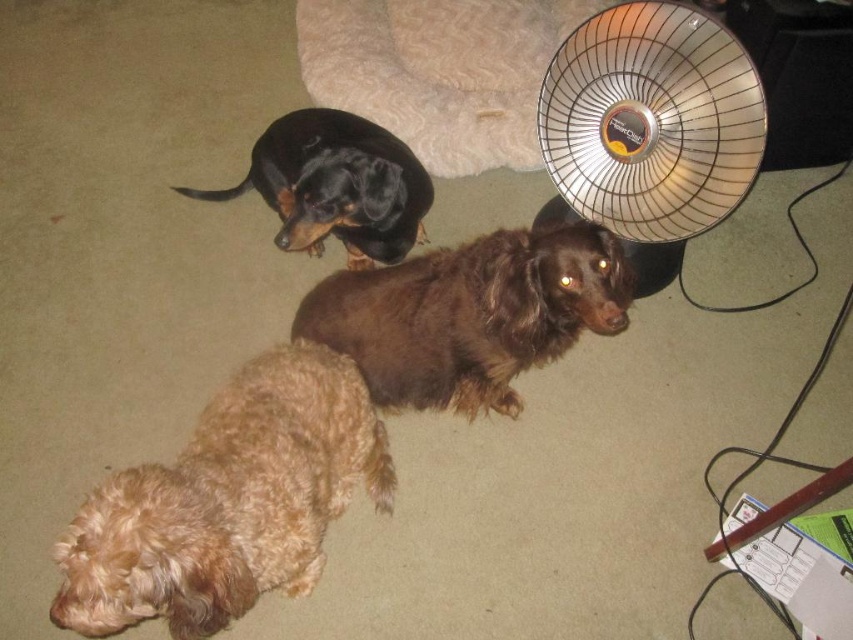
Question: Does beige plush dog bed at upper center appear over black glossy dog at upper center?

Choices:
 (A) yes
 (B) no

Answer: (A)

Question: Does brown furry dog at center appear on the right side of beige plush dog bed at upper center?

Choices:
 (A) no
 (B) yes

Answer: (B)

Question: Which point is closer to the camera?

Choices:
 (A) (358, 120)
 (B) (531, 93)
 (C) (611, 288)
 (D) (100, 609)

Answer: (D)

Question: Among these points, which one is nearest to the camera?

Choices:
 (A) (189, 188)
 (B) (438, 67)

Answer: (A)

Question: In this image, where is brown furry dog at center located relative to black glossy dog at upper center?

Choices:
 (A) left
 (B) right

Answer: (B)

Question: Which of the following is the farthest from the observer?

Choices:
 (A) (610, 54)
 (B) (376, 93)
 (C) (457, 396)
 (D) (357, 220)

Answer: (B)